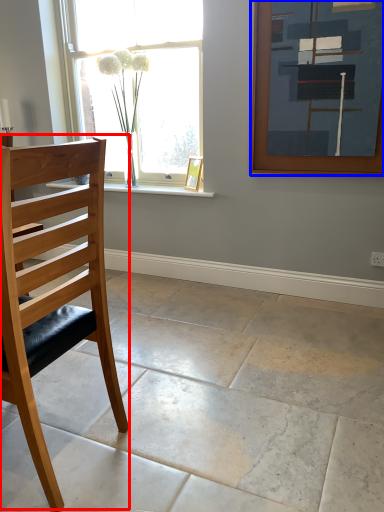
Question: Which of the following is the farthest to the observer, chair (highlighted by a red box) or picture frame (highlighted by a blue box)?

Choices:
 (A) chair
 (B) picture frame

Answer: (B)